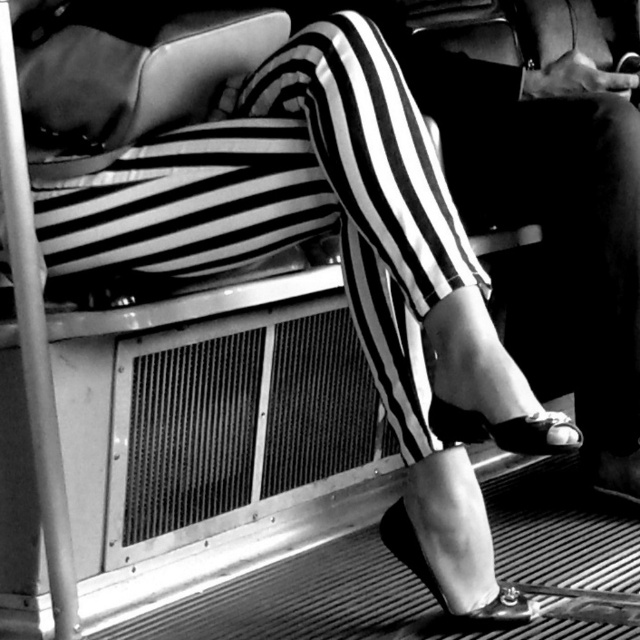
Is shiny black sandal at lower center to the right of shiny patent leather sandal at lower center from the viewer's perspective?

Yes, shiny black sandal at lower center is to the right of shiny patent leather sandal at lower center.

Between point (497, 429) and point (522, 596), which one is positioned behind?

Positioned behind is point (522, 596).

Describe the element at coordinates (500, 429) in the screenshot. I see `shiny black sandal at lower center` at that location.

Locate an element on the screen. The width and height of the screenshot is (640, 640). shiny black sandal at lower center is located at coordinates (500, 429).

Consider the image. Who is positioned more to the left, shiny black sandal at lower center or shiny black sandal at lower right?

Positioned to the left is shiny black sandal at lower center.

Is point (442, 422) closer to viewer compared to point (609, 474)?

Yes, point (442, 422) is closer to viewer.

Find the location of a particular element. This screenshot has width=640, height=640. shiny black sandal at lower center is located at coordinates (500, 429).

Which is behind, point (442, 605) or point (620, 490)?

Point (620, 490)

Does shiny patent leather sandal at lower center appear under shiny black sandal at lower right?

Correct, shiny patent leather sandal at lower center is located below shiny black sandal at lower right.

Is point (408, 547) more distant than point (589, 454)?

No, it is in front of (589, 454).

Find the location of a particular element. This screenshot has height=640, width=640. shiny patent leather sandal at lower center is located at coordinates (435, 579).